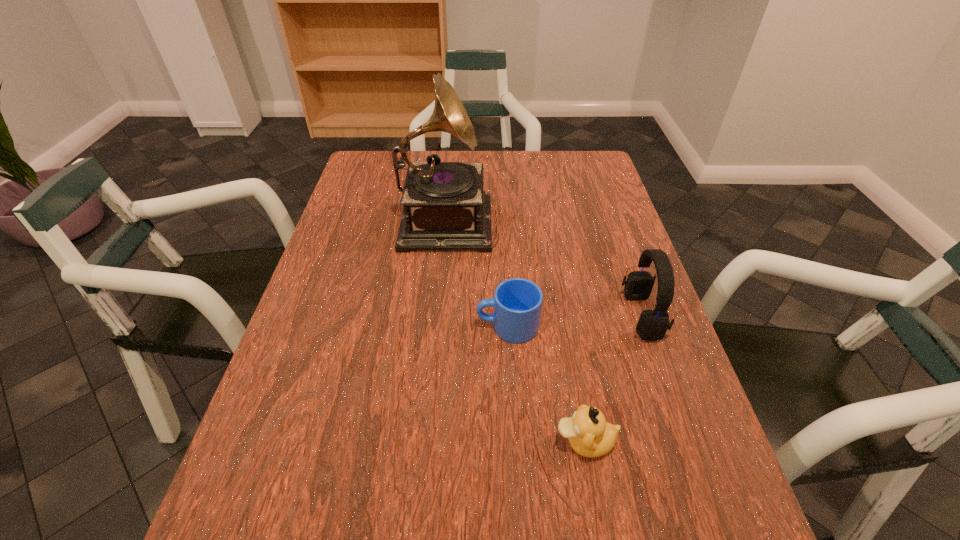
Locate an element on the screen. Image resolution: width=960 pixels, height=540 pixels. vacant space at the left edge is located at coordinates point(335,417).

What are the coordinates of `vacant area at the right edge of the desktop` in the screenshot? It's located at (660, 394).

The image size is (960, 540). I want to click on free space at the far right corner of the desktop, so click(x=559, y=165).

You are a GUI agent. You are given a task and a screenshot of the screen. Output one action in this format:
    pyautogui.click(x=<x>, y=<y>)
    Task: Click on the blank region between the tallest object and the mug
    
    Given the screenshot: What is the action you would take?
    pyautogui.click(x=476, y=272)

Find the location of `vacant space in between the mug and the farthest object`. vacant space in between the mug and the farthest object is located at coordinates (476, 272).

Image resolution: width=960 pixels, height=540 pixels. In order to click on vacant area that lies between the nearest object and the second tallest object in this screenshot , I will do `click(612, 379)`.

I want to click on free space between the mug and the headset, so click(574, 321).

Identify the location of unoccupied area between the farthest object and the rightmost object. (542, 266).

I want to click on free area in between the farthest object and the mug, so click(x=476, y=272).

This screenshot has width=960, height=540. Identify the location of empty space that is in between the second tallest object and the duckling. (612, 379).